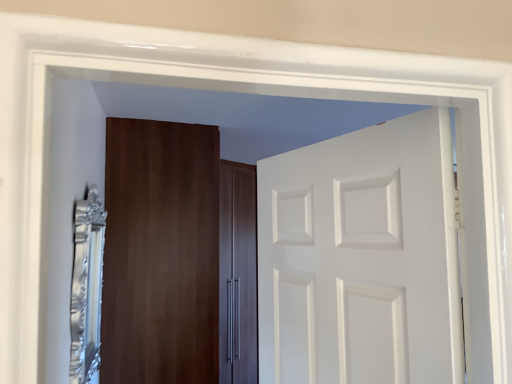
In order to click on silver metallic mirror at left in this screenshot , I will do `click(87, 287)`.

This screenshot has height=384, width=512. What do you see at coordinates (87, 287) in the screenshot?
I see `silver metallic mirror at left` at bounding box center [87, 287].

Locate an element on the screen. This screenshot has height=384, width=512. white matte door at center, which is the 1th door in front-to-back order is located at coordinates (361, 258).

The image size is (512, 384). I want to click on matte wood cabinet at center, which is the 2th door from right to left, so click(160, 253).

How different are the orientations of matte wood cabinet at center, which ranks as the 1th door in left-to-right order, and white matte door at center, which is the 1th door in front-to-back order, in degrees?

166 degrees separate the facing orientations of matte wood cabinet at center, which ranks as the 1th door in left-to-right order, and white matte door at center, which is the 1th door in front-to-back order.

Is matte wood cabinet at center, the first door positioned from the back, placed right next to white matte door at center, which ranks as the 2th door in left-to-right order?

No, matte wood cabinet at center, the first door positioned from the back, is not in contact with white matte door at center, which ranks as the 2th door in left-to-right order.

Considering the positions of objects matte wood cabinet at center, the first door positioned from the back, and white matte door at center, which is the 1th door in front-to-back order, in the image provided, who is in front, matte wood cabinet at center, the first door positioned from the back, or white matte door at center, which is the 1th door in front-to-back order,?

white matte door at center, which is the 1th door in front-to-back order, is closer to the camera.

Is the depth of silver metallic mirror at left less than that of white matte door at center, which appears as the first door when viewed from the right?

No.

Is silver metallic mirror at left far away from white matte door at center, which ranks as the 2th door in left-to-right order?

No, silver metallic mirror at left is not far from white matte door at center, which ranks as the 2th door in left-to-right order.

Is silver metallic mirror at left positioned beyond the bounds of white matte door at center, which ranks as the 2th door in left-to-right order?

Absolutely, silver metallic mirror at left is external to white matte door at center, which ranks as the 2th door in left-to-right order.

Between matte wood cabinet at center, the first door positioned from the back, and silver metallic mirror at left, which one is positioned behind?

matte wood cabinet at center, the first door positioned from the back.

Can we say matte wood cabinet at center, arranged as the 2th door when viewed from the front, lies outside silver metallic mirror at left?

Indeed, matte wood cabinet at center, arranged as the 2th door when viewed from the front, is completely outside silver metallic mirror at left.

Considering the positions of points (161, 254) and (87, 239), is point (161, 254) farther from camera compared to point (87, 239)?

Yes, it is.

Considering the sizes of objects matte wood cabinet at center, which ranks as the 1th door in left-to-right order, and silver metallic mirror at left in the image provided, who is smaller, matte wood cabinet at center, which ranks as the 1th door in left-to-right order, or silver metallic mirror at left?

Smaller between the two is silver metallic mirror at left.

How different are the orientations of white matte door at center, which is the 1th door in front-to-back order, and matte wood cabinet at center, which ranks as the 1th door in left-to-right order, in degrees?

The angle between the facing direction of white matte door at center, which is the 1th door in front-to-back order, and the facing direction of matte wood cabinet at center, which ranks as the 1th door in left-to-right order, is 166 degrees.

Is white matte door at center, which appears as the first door when viewed from the right, in contact with matte wood cabinet at center, which ranks as the 1th door in left-to-right order?

No, white matte door at center, which appears as the first door when viewed from the right, is not touching matte wood cabinet at center, which ranks as the 1th door in left-to-right order.

From a real-world perspective, is white matte door at center, which is the 1th door in front-to-back order, located higher than matte wood cabinet at center, which ranks as the 1th door in left-to-right order?

Correct, in the physical world, white matte door at center, which is the 1th door in front-to-back order, is higher than matte wood cabinet at center, which ranks as the 1th door in left-to-right order.

Who is shorter, white matte door at center, which appears as the first door when viewed from the right, or matte wood cabinet at center, which ranks as the 1th door in left-to-right order?

white matte door at center, which appears as the first door when viewed from the right, is shorter.

Can you see white matte door at center, the second door viewed from the back, touching silver metallic mirror at left?

They are not placed beside each other.

Can you tell me how much white matte door at center, which is the 1th door in front-to-back order, and silver metallic mirror at left differ in facing direction?

The angular difference between white matte door at center, which is the 1th door in front-to-back order, and silver metallic mirror at left is 165 degrees.

From the image's perspective, which one is positioned higher, white matte door at center, which ranks as the 2th door in left-to-right order, or silver metallic mirror at left?

white matte door at center, which ranks as the 2th door in left-to-right order, is shown above in the image.

This screenshot has height=384, width=512. What are the coordinates of `door above the silver metallic mirror at left (from the image's perspective)` in the screenshot? It's located at (361, 258).

How distant is silver metallic mirror at left from matte wood cabinet at center, arranged as the 2th door when viewed from the front?

They are 16.94 inches apart.

From the image's perspective, which is above, silver metallic mirror at left or matte wood cabinet at center, arranged as the 2th door when viewed from the front?

silver metallic mirror at left is shown above in the image.

Between silver metallic mirror at left and matte wood cabinet at center, the first door positioned from the back, which one has larger width?

matte wood cabinet at center, the first door positioned from the back, is wider.

Can you confirm if silver metallic mirror at left is smaller than matte wood cabinet at center, which ranks as the 1th door in left-to-right order?

Indeed, silver metallic mirror at left has a smaller size compared to matte wood cabinet at center, which ranks as the 1th door in left-to-right order.

Locate an element on the screen. The width and height of the screenshot is (512, 384). door in front of the matte wood cabinet at center, which ranks as the 1th door in left-to-right order is located at coordinates [361, 258].

This screenshot has height=384, width=512. Identify the location of mirror lying on the left of white matte door at center, which appears as the first door when viewed from the right. (87, 287).

Which object lies further to the anchor point matte wood cabinet at center, which ranks as the 1th door in left-to-right order, white matte door at center, which appears as the first door when viewed from the right, or silver metallic mirror at left?

Among the two, white matte door at center, which appears as the first door when viewed from the right, is located further to matte wood cabinet at center, which ranks as the 1th door in left-to-right order.

Based on the photo, considering their positions, is silver metallic mirror at left positioned closer to white matte door at center, which ranks as the 2th door in left-to-right order, than matte wood cabinet at center, which is the 2th door from right to left?

silver metallic mirror at left lies closer to white matte door at center, which ranks as the 2th door in left-to-right order, than the other object.

From the image, which object appears to be nearer to matte wood cabinet at center, the first door positioned from the back, silver metallic mirror at left or white matte door at center, which appears as the first door when viewed from the right?

silver metallic mirror at left is positioned closer to the anchor matte wood cabinet at center, the first door positioned from the back.

Which object lies further to the anchor point white matte door at center, which appears as the first door when viewed from the right, matte wood cabinet at center, which is the 2th door from right to left, or silver metallic mirror at left?

The object further to white matte door at center, which appears as the first door when viewed from the right, is matte wood cabinet at center, which is the 2th door from right to left.

From the image, which object appears to be farther from silver metallic mirror at left, matte wood cabinet at center, arranged as the 2th door when viewed from the front, or white matte door at center, the second door viewed from the back?

white matte door at center, the second door viewed from the back, is further to silver metallic mirror at left.

Considering their positions, is white matte door at center, the second door viewed from the back, positioned further to silver metallic mirror at left than matte wood cabinet at center, which ranks as the 1th door in left-to-right order?

white matte door at center, the second door viewed from the back, is further to silver metallic mirror at left.

Where is `mirror between white matte door at center, which ranks as the 2th door in left-to-right order, and matte wood cabinet at center, which is the 2th door from right to left, from front to back`? The height and width of the screenshot is (384, 512). mirror between white matte door at center, which ranks as the 2th door in left-to-right order, and matte wood cabinet at center, which is the 2th door from right to left, from front to back is located at coordinates (87, 287).